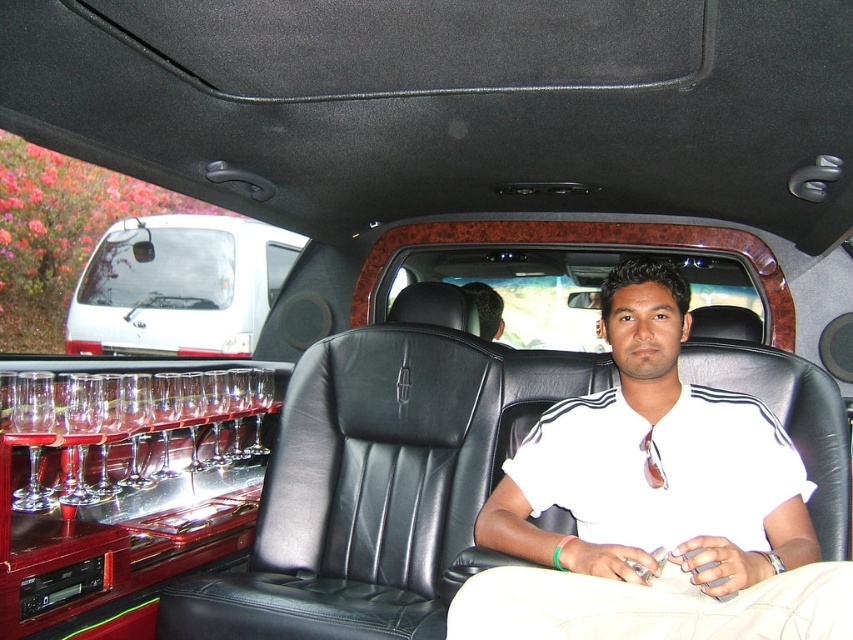
Question: Which of the following is the closest to the observer?

Choices:
 (A) white glossy minivan at upper left
 (B) clear glass wine glass at left
 (C) white matte shirt at center

Answer: (C)

Question: Is clear glass wine glass at left thinner than white glossy minivan at upper left?

Choices:
 (A) no
 (B) yes

Answer: (B)

Question: Estimate the real-world distances between objects in this image. Which object is farther from the white glossy minivan at upper left?

Choices:
 (A) white matte shirt at center
 (B) clear glass wine glass at left

Answer: (A)

Question: Does white matte shirt at center have a greater width compared to white glossy minivan at upper left?

Choices:
 (A) no
 (B) yes

Answer: (A)

Question: Does white matte shirt at center appear on the right side of white glossy minivan at upper left?

Choices:
 (A) no
 (B) yes

Answer: (B)

Question: Which of the following is the farthest from the observer?

Choices:
 (A) (758, 513)
 (B) (102, 416)
 (C) (187, 225)

Answer: (C)